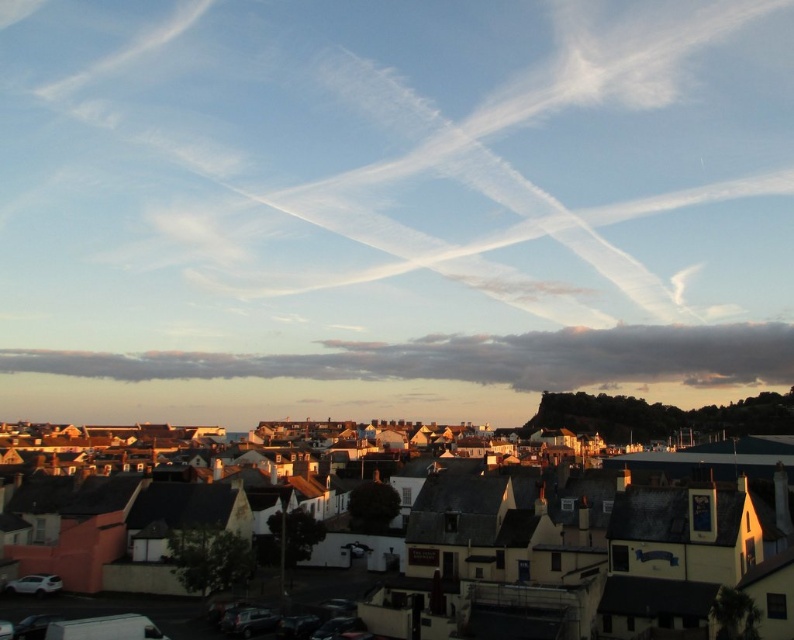
Does white wispy clouds at upper center come behind cloudy sky at lower center?

No, it is not.

Who is more distant from viewer, (313,321) or (530,342)?

The point (313,321) is behind.

Which is in front, point (338, 332) or point (380, 340)?

Point (380, 340) is in front.

The image size is (794, 640). I want to click on white wispy clouds at upper center, so click(394, 188).

Between white wispy clouds at upper center and matte yellow building at center, which one is positioned higher?

white wispy clouds at upper center

Locate an element on the screen. The width and height of the screenshot is (794, 640). white wispy clouds at upper center is located at coordinates (394, 188).

Is matte yellow building at center below cloudy sky at lower center?

No.

Between matte yellow building at center and cloudy sky at lower center, which one appears on the right side from the viewer's perspective?

matte yellow building at center is more to the right.

Locate an element on the screen. This screenshot has width=794, height=640. matte yellow building at center is located at coordinates (606, 529).